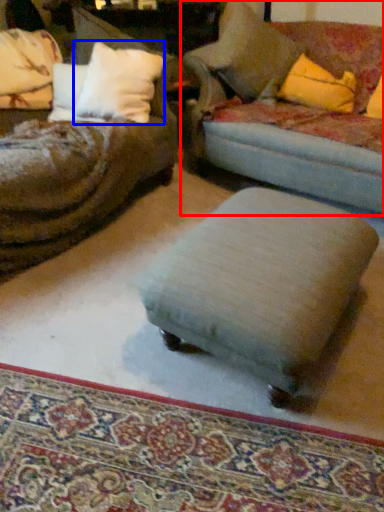
Question: Which point is closer to the camera, studio couch (highlighted by a red box) or pillow (highlighted by a blue box)?

Choices:
 (A) studio couch
 (B) pillow

Answer: (A)